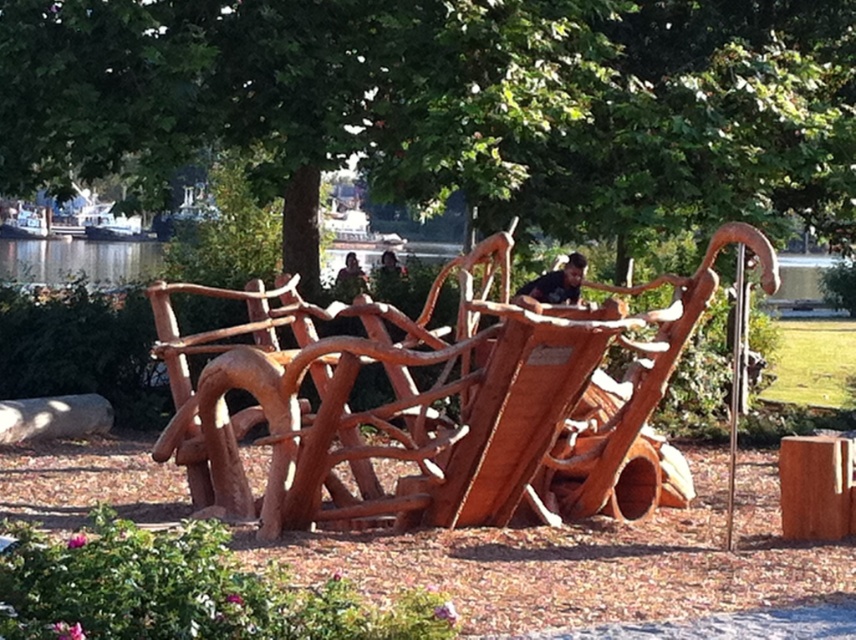
You are standing in front of the brown wooden post at center in the outdoor sculpture garden. If you walk directly towards it, how many steps will it take you to reach it, assuming each step covers approximately 3 feet?

The brown wooden post at center is 32.36 feet away from the viewer. Dividing the distance by the step length of 3 feet gives approximately 10.78 steps. Since you can only take whole steps, you would need to take 11 steps to reach the brown wooden post at center.

You are planning to place a new flower pot that is 1.2 meters wide between the natural wood sleigh at center and the matte brown wooden bench at center. Considering their widths, will there be enough space for the flower pot to fit between them?

The natural wood sleigh at center has a larger width than the matte brown wooden bench at center. However, the total space between them depends on their individual widths and the distance between their edges. Since the flower pot is 1.2 meters wide, we need to know the exact measurements of the space between the two objects to determine if it can fit. The given information only states that the sleigh is wider than the bench, but without specific dimensions for their separation, we cannot confirm if the 1.2m

You are standing at the point closest to the wooden sculpture in the image. Which point, point (801,467) or point (354,260), is closer to you?

Point (801,467) is closer to you because it is in front of point (354,260).